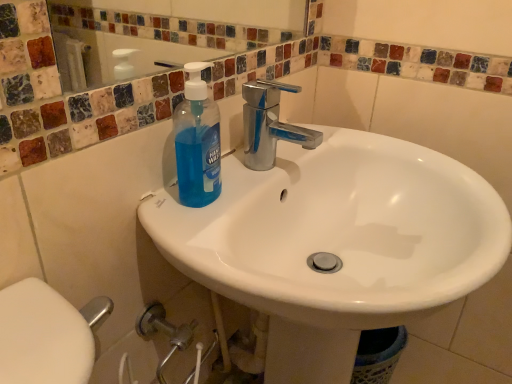
What do you see at coordinates (197, 142) in the screenshot? The height and width of the screenshot is (384, 512). I see `blue translucent liquid soap at center` at bounding box center [197, 142].

In order to face blue translucent liquid soap at center, should I rotate leftwards or rightwards?

To face it directly, rotate left by 7.886 degrees.

At what (x,y) coordinates should I click in order to perform the action: click on blue translucent liquid soap at center. Please return your answer as a coordinate pair (x, y). The image size is (512, 384). Looking at the image, I should click on (197, 142).

Image resolution: width=512 pixels, height=384 pixels. Find the location of `white glossy sink at center`. white glossy sink at center is located at coordinates (337, 243).

The image size is (512, 384). What do you see at coordinates (337, 243) in the screenshot?
I see `white glossy sink at center` at bounding box center [337, 243].

Locate an element on the screen. The image size is (512, 384). blue translucent liquid soap at center is located at coordinates (197, 142).

Would you say white glossy sink at center is to the left or to the right of blue translucent liquid soap at center in the picture?

white glossy sink at center is to the right of blue translucent liquid soap at center.

Considering the relative positions of white glossy sink at center and blue translucent liquid soap at center in the image provided, is white glossy sink at center behind blue translucent liquid soap at center?

No, white glossy sink at center is in front of blue translucent liquid soap at center.

Which point is more distant from viewer, (x=305, y=192) or (x=196, y=160)?

Point (x=305, y=192)

From the image's perspective, between white glossy sink at center and blue translucent liquid soap at center, who is located below?

white glossy sink at center, from the image's perspective.

From a real-world perspective, between white glossy sink at center and blue translucent liquid soap at center, who is vertically lower?

white glossy sink at center, from a real-world perspective.

Which object is thinner, white glossy sink at center or blue translucent liquid soap at center?

Thinner between the two is blue translucent liquid soap at center.

Which of these two, white glossy sink at center or blue translucent liquid soap at center, stands taller?

white glossy sink at center is taller.

Can you confirm if white glossy sink at center is bigger than blue translucent liquid soap at center?

Correct, white glossy sink at center is larger in size than blue translucent liquid soap at center.

Would you say white glossy sink at center is inside or outside blue translucent liquid soap at center?

white glossy sink at center is spatially situated outside blue translucent liquid soap at center.

Is white glossy sink at center positioned far away from blue translucent liquid soap at center?

No.

Consider the image. Is white glossy sink at center oriented towards blue translucent liquid soap at center?

No.

Measure the distance between white glossy sink at center and blue translucent liquid soap at center.

white glossy sink at center and blue translucent liquid soap at center are 8.86 inches apart.

This screenshot has height=384, width=512. Find the location of `cleaning product on the left of white glossy sink at center`. cleaning product on the left of white glossy sink at center is located at coordinates [x=197, y=142].

Considering the positions of objects blue translucent liquid soap at center and white glossy sink at center in the image provided, who is more to the left, blue translucent liquid soap at center or white glossy sink at center?

blue translucent liquid soap at center.

Considering their positions, is blue translucent liquid soap at center located in front of or behind white glossy sink at center?

blue translucent liquid soap at center is behind white glossy sink at center.

Considering the points (194, 93) and (268, 271), which point is behind, point (194, 93) or point (268, 271)?

The point (268, 271) is farther from the camera.

From the image's perspective, which is below, blue translucent liquid soap at center or white glossy sink at center?

From the image's view, white glossy sink at center is below.

From a real-world perspective, is blue translucent liquid soap at center positioned above or below white glossy sink at center?

Clearly, from a real-world perspective, blue translucent liquid soap at center is above white glossy sink at center.

In the scene shown: Can you confirm if blue translucent liquid soap at center is wider than white glossy sink at center?

No, blue translucent liquid soap at center is not wider than white glossy sink at center.

Considering the sizes of objects blue translucent liquid soap at center and white glossy sink at center in the image provided, who is taller, blue translucent liquid soap at center or white glossy sink at center?

white glossy sink at center is taller.

Which of these two, blue translucent liquid soap at center or white glossy sink at center, is smaller?

blue translucent liquid soap at center is smaller.

Is white glossy sink at center located within blue translucent liquid soap at center?

That's incorrect, white glossy sink at center is not inside blue translucent liquid soap at center.

Is blue translucent liquid soap at center with white glossy sink at center?

No.

Does blue translucent liquid soap at center turn towards white glossy sink at center?

Yes, blue translucent liquid soap at center is facing white glossy sink at center.

Consider the image. How many degrees apart are the facing directions of blue translucent liquid soap at center and white glossy sink at center?

4.24 degrees.

Measure the distance between blue translucent liquid soap at center and white glossy sink at center.

blue translucent liquid soap at center is 8.86 inches away from white glossy sink at center.

This screenshot has width=512, height=384. What are the coordinates of `sink in front of the blue translucent liquid soap at center` in the screenshot? It's located at (337, 243).

Where is `sink to the right of blue translucent liquid soap at center`? sink to the right of blue translucent liquid soap at center is located at coordinates (337, 243).

Locate an element on the screen. The height and width of the screenshot is (384, 512). cleaning product located on the left of white glossy sink at center is located at coordinates 197,142.